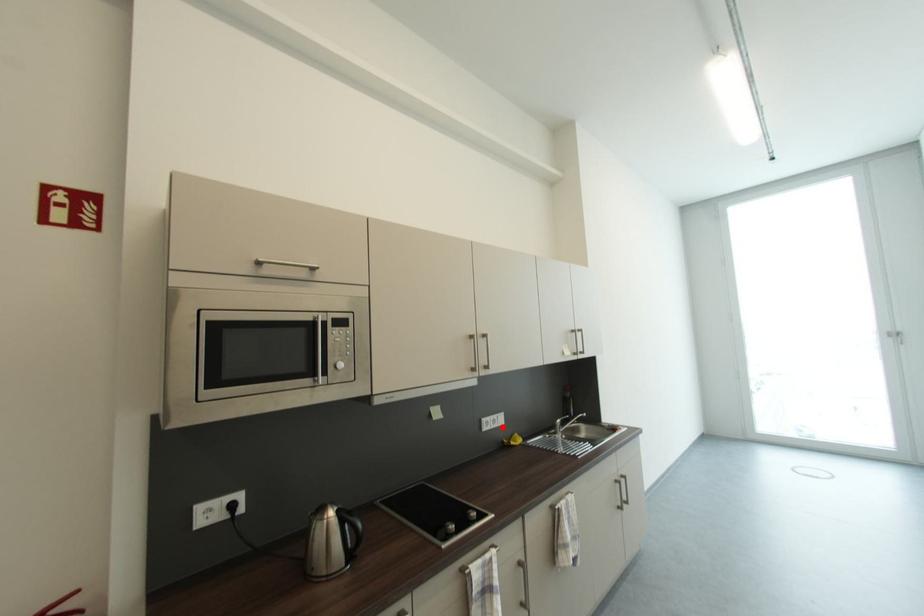
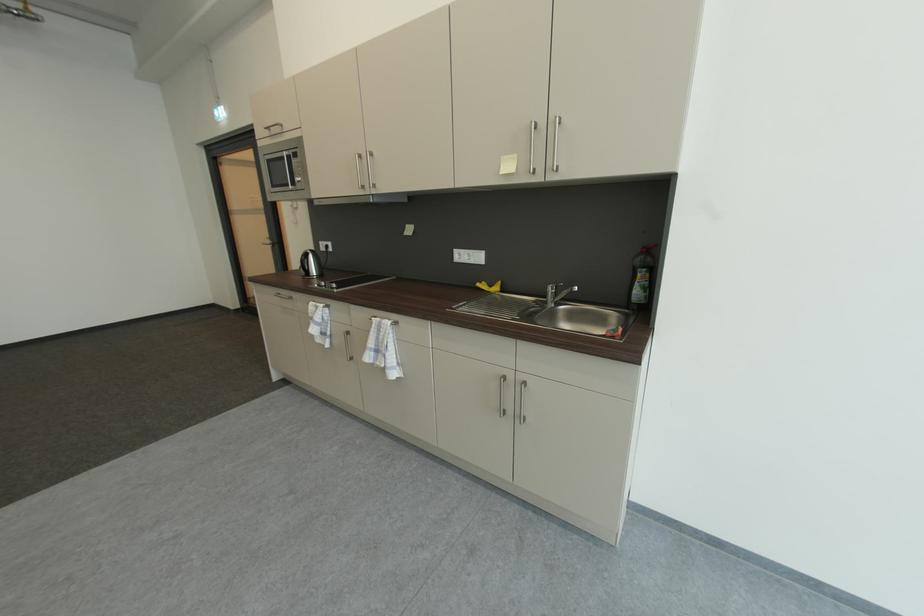
The point at the highlighted location is marked in the first image. Where is the corresponding point in the second image?

(479, 262)